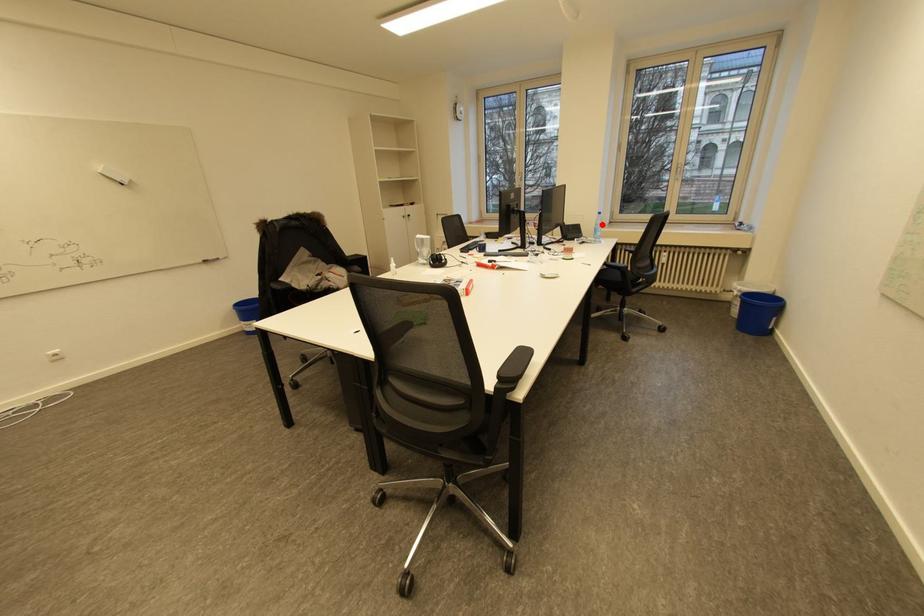
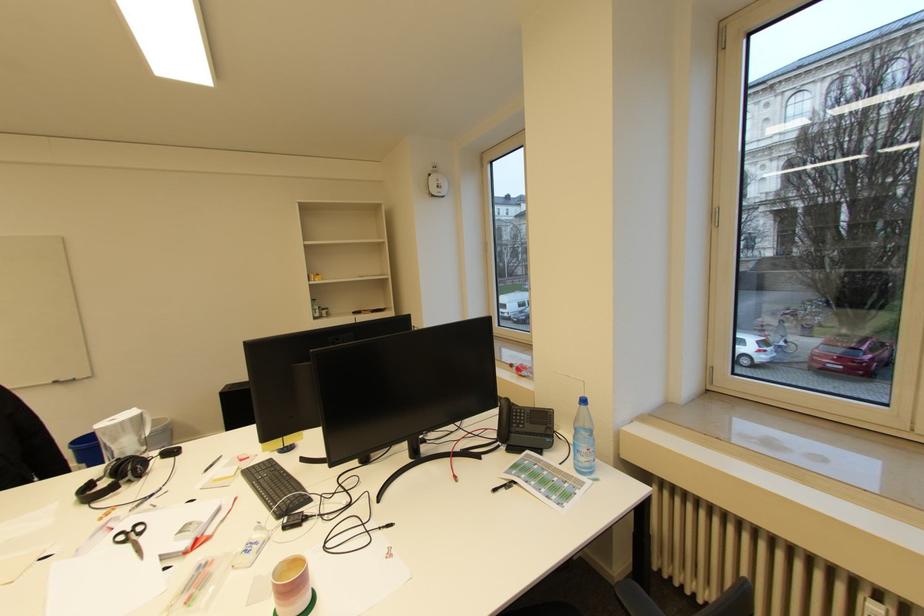
Where in the second image is the point corresponding to the highlighted location from the first image?

(581, 429)